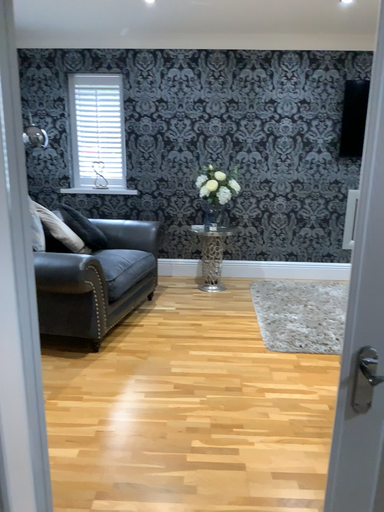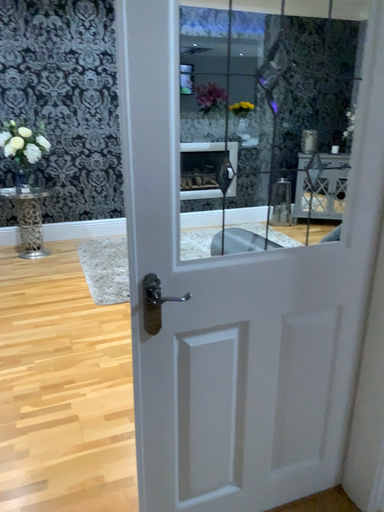
Question: Which way did the camera rotate in the video?

Choices:
 (A) rotated left
 (B) rotated right

Answer: (B)